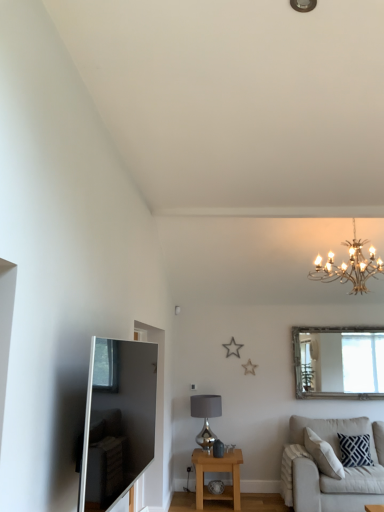
Question: Does silver metallic lampshade at center have a greater height compared to navy blue textured pillow at lower right?

Choices:
 (A) no
 (B) yes

Answer: (B)

Question: Are silver metallic lampshade at center and navy blue textured pillow at lower right making contact?

Choices:
 (A) no
 (B) yes

Answer: (A)

Question: Would you consider silver metallic lampshade at center to be distant from navy blue textured pillow at lower right?

Choices:
 (A) no
 (B) yes

Answer: (B)

Question: Can you confirm if silver metallic lampshade at center is positioned to the left of navy blue textured pillow at lower right?

Choices:
 (A) yes
 (B) no

Answer: (A)

Question: Does silver metallic lampshade at center lie in front of navy blue textured pillow at lower right?

Choices:
 (A) yes
 (B) no

Answer: (B)

Question: Is navy blue textured pillow at lower right inside silver metallic lampshade at center?

Choices:
 (A) yes
 (B) no

Answer: (B)

Question: Is gold metallic chandelier at upper right inside satin silver tv at left?

Choices:
 (A) no
 (B) yes

Answer: (A)

Question: From a real-world perspective, is satin silver tv at left physically below gold metallic chandelier at upper right?

Choices:
 (A) no
 (B) yes

Answer: (B)

Question: Is satin silver tv at left outside of gold metallic chandelier at upper right?

Choices:
 (A) yes
 (B) no

Answer: (A)

Question: Is satin silver tv at left wider than gold metallic chandelier at upper right?

Choices:
 (A) yes
 (B) no

Answer: (B)

Question: Is satin silver tv at left to the left of gold metallic chandelier at upper right from the viewer's perspective?

Choices:
 (A) yes
 (B) no

Answer: (A)

Question: Considering the relative sizes of satin silver tv at left and gold metallic chandelier at upper right in the image provided, is satin silver tv at left taller than gold metallic chandelier at upper right?

Choices:
 (A) no
 (B) yes

Answer: (A)

Question: Does silver-framed mirror at upper right come in front of silver metallic lampshade at center?

Choices:
 (A) no
 (B) yes

Answer: (A)